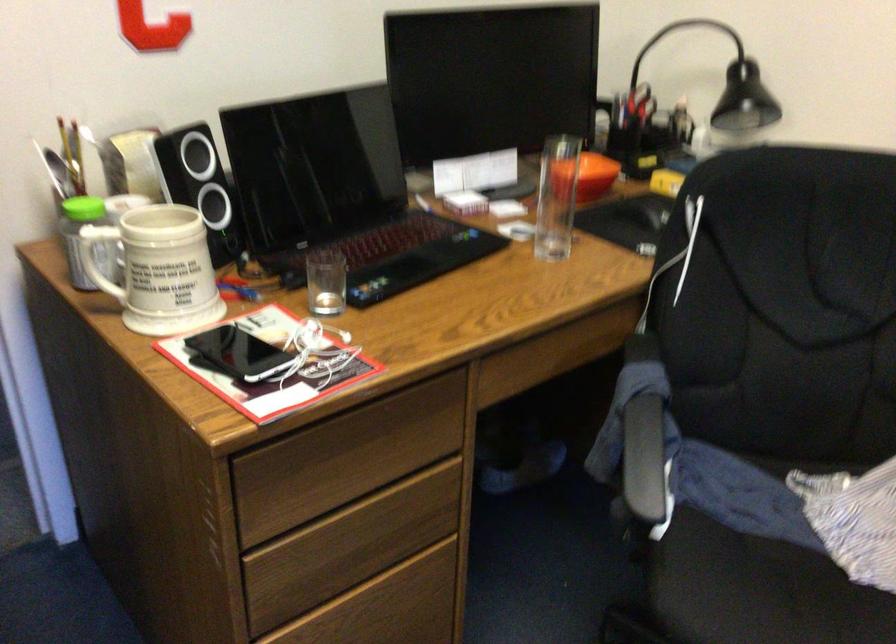
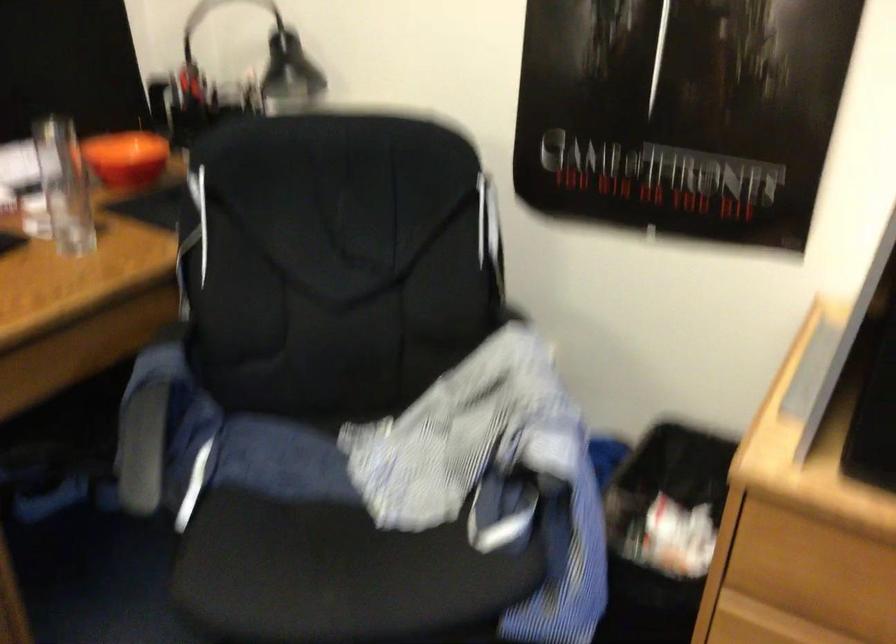
Question: What movement of the cameraman would produce the second image?

Choices:
 (A) Left
 (B) Right
 (C) Forward
 (D) Backward

Answer: (B)